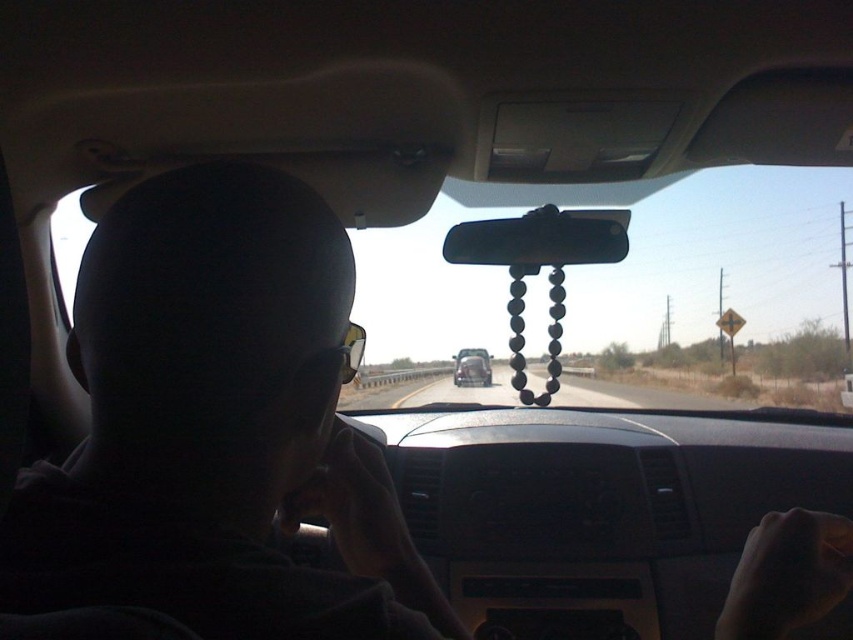
Question: Can you confirm if black glossy mirror at center is positioned to the left of metallic silver car at center?

Choices:
 (A) no
 (B) yes

Answer: (A)

Question: Is black glossy mirror at center further to camera compared to metallic silver car at center?

Choices:
 (A) no
 (B) yes

Answer: (A)

Question: Considering the relative positions of black glossy mirror at center and metallic silver car at center in the image provided, where is black glossy mirror at center located with respect to metallic silver car at center?

Choices:
 (A) above
 (B) below

Answer: (A)

Question: Which object appears farthest from the camera in this image?

Choices:
 (A) metallic silver car at center
 (B) black glossy mirror at center

Answer: (A)

Question: Which object is closer to the camera taking this photo?

Choices:
 (A) black glossy mirror at center
 (B) metallic silver car at center

Answer: (A)